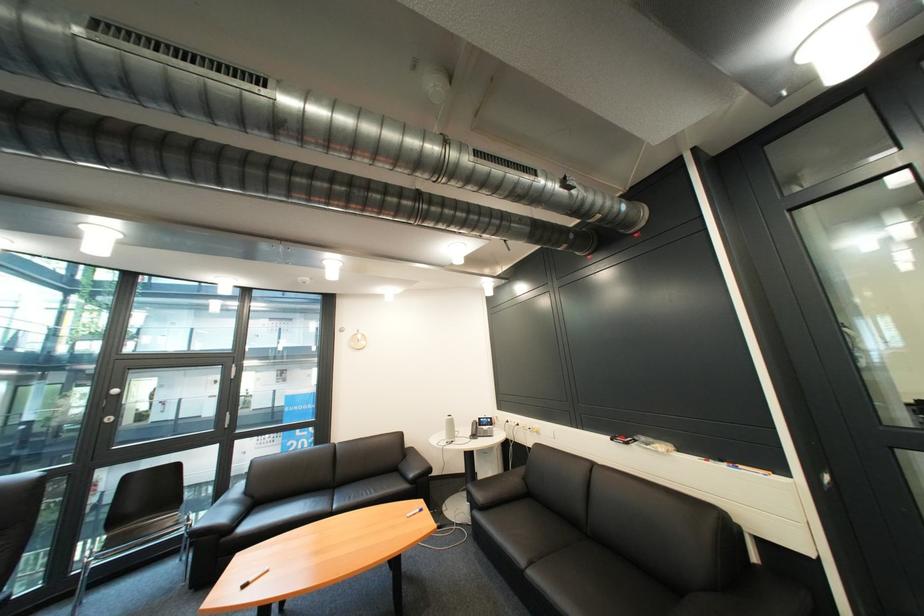
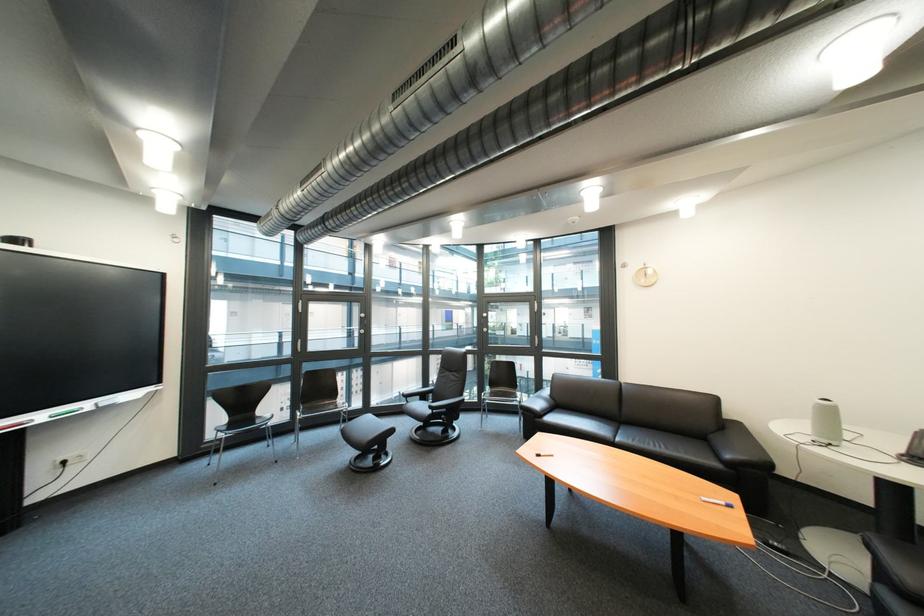
Where in the second image is the point corresponding to point 460,421 from the first image?

(833, 406)